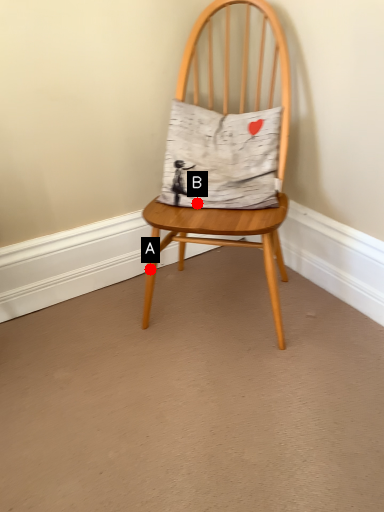
Question: Two points are circled on the image, labeled by A and B beside each circle. Which of the following is the farthest from the observer?

Choices:
 (A) A is further
 (B) B is further

Answer: (A)